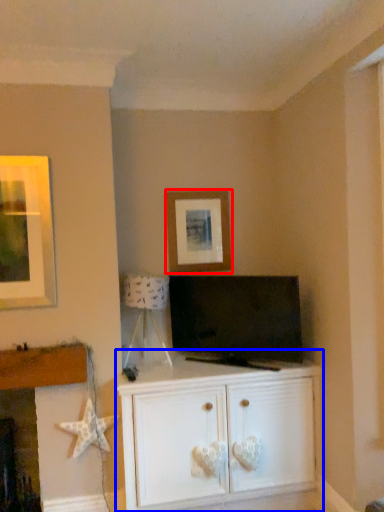
Question: Which point is further to the camera, picture frame (highlighted by a red box) or cabinetry (highlighted by a blue box)?

Choices:
 (A) picture frame
 (B) cabinetry

Answer: (A)